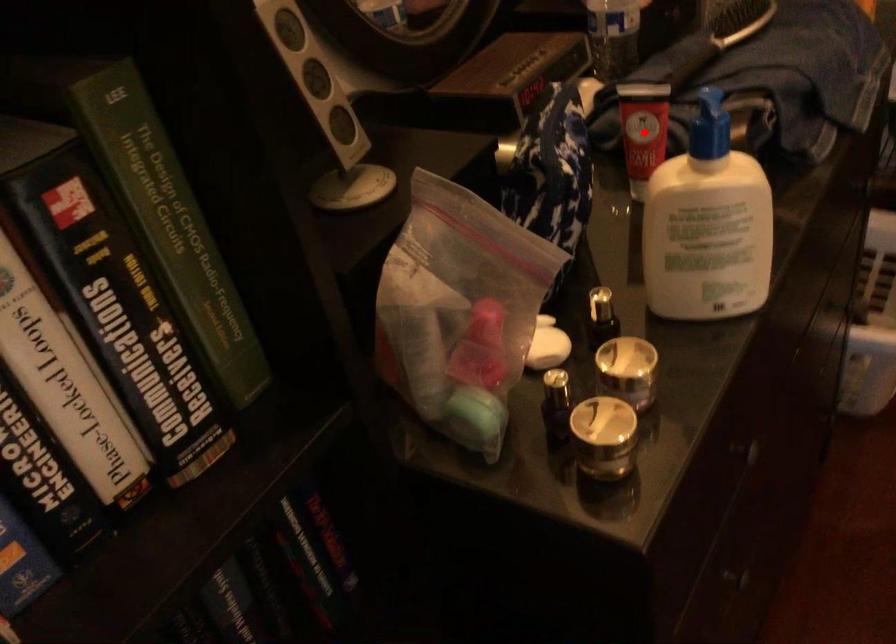
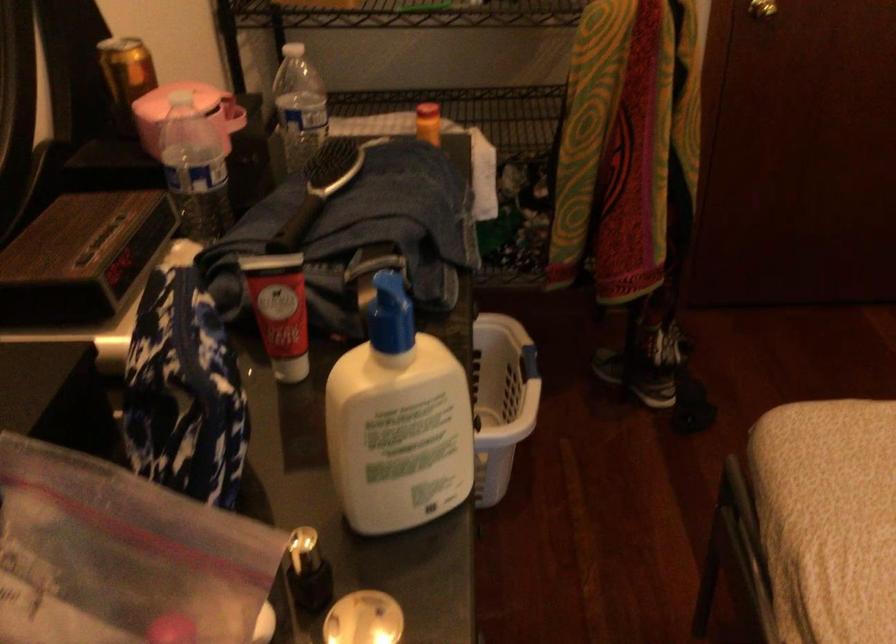
In the second image, find the point that corresponds to the highlighted location in the first image.

(280, 310)